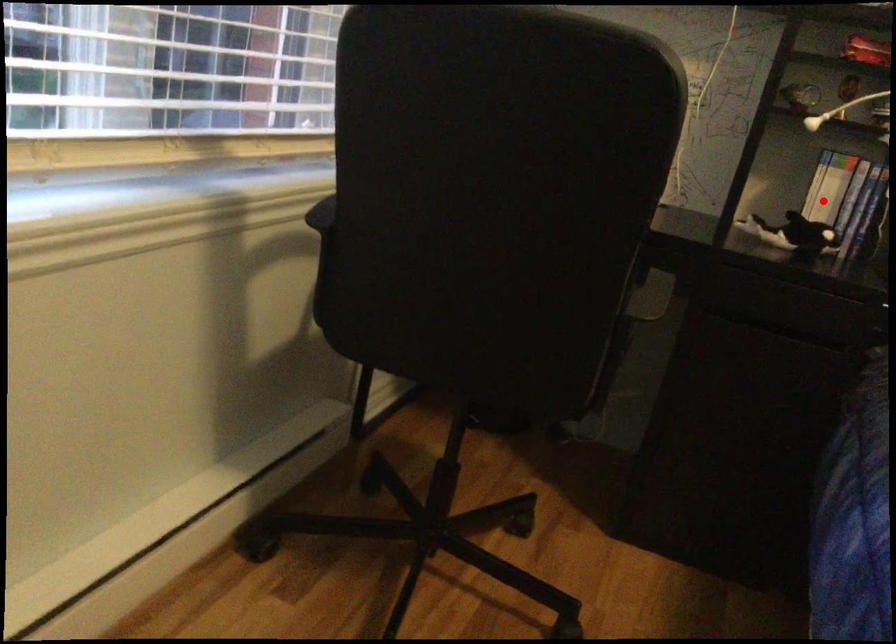
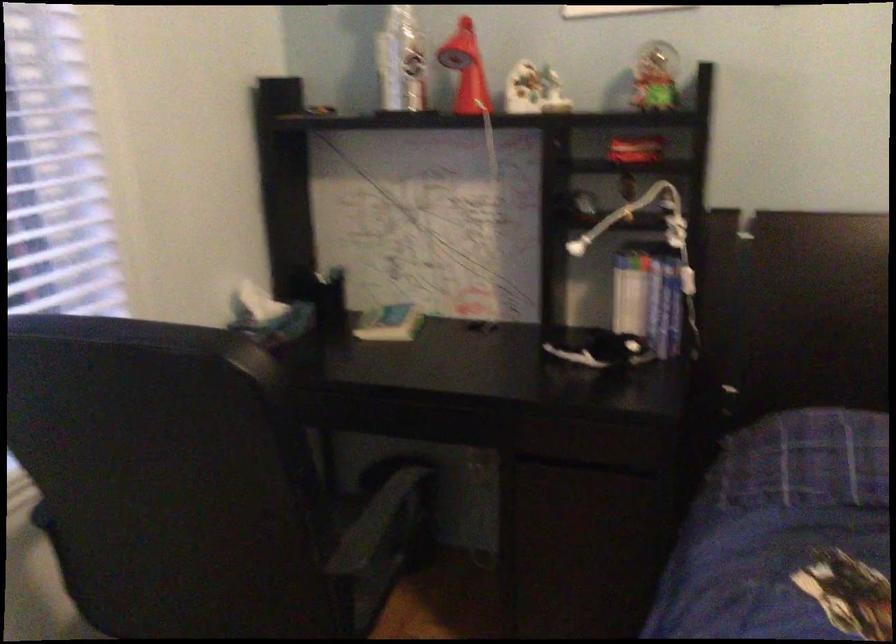
Where in the second image is the point corresponding to the highlighted location from the first image?

(629, 301)